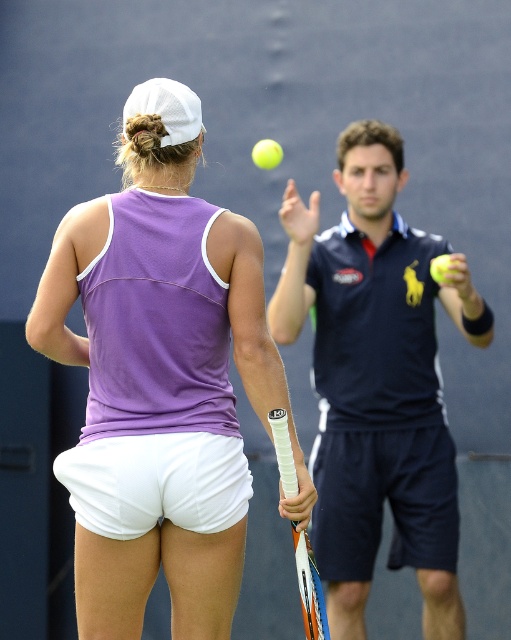
Looking at this image, is dark blue polo shirt at center to the left of yellow matte tennis ball at center from the viewer's perspective?

No, dark blue polo shirt at center is not to the left of yellow matte tennis ball at center.

Image resolution: width=511 pixels, height=640 pixels. What do you see at coordinates (377, 381) in the screenshot? I see `dark blue polo shirt at center` at bounding box center [377, 381].

Between point (346, 355) and point (265, 140), which one is positioned in front?

Point (346, 355) is more forward.

You are a GUI agent. You are given a task and a screenshot of the screen. Output one action in this format:
    pyautogui.click(x=<x>, y=<y>)
    Task: Click on the dark blue polo shirt at center
    This screenshot has width=511, height=640.
    Given the screenshot: What is the action you would take?
    pyautogui.click(x=377, y=381)

Can you confirm if purple fabric tennis outfit at center is shorter than dark blue polo shirt at center?

Correct, purple fabric tennis outfit at center is not as tall as dark blue polo shirt at center.

You are a GUI agent. You are given a task and a screenshot of the screen. Output one action in this format:
    pyautogui.click(x=<x>, y=<y>)
    Task: Click on the purple fabric tennis outfit at center
    The image size is (511, 640).
    Given the screenshot: What is the action you would take?
    pyautogui.click(x=159, y=289)

I want to click on purple fabric tennis outfit at center, so click(x=159, y=289).

Find the location of a particular element. The image size is (511, 640). purple fabric tennis outfit at center is located at coordinates (159, 289).

Describe the element at coordinates (377, 381) in the screenshot. I see `dark blue polo shirt at center` at that location.

Is dark blue polo shirt at center to the left of white textured grip at lower center from the viewer's perspective?

Incorrect, dark blue polo shirt at center is not on the left side of white textured grip at lower center.

Who is more forward, (314,371) or (301,544)?

Positioned in front is point (301,544).

Locate an element on the screen. dark blue polo shirt at center is located at coordinates (377, 381).